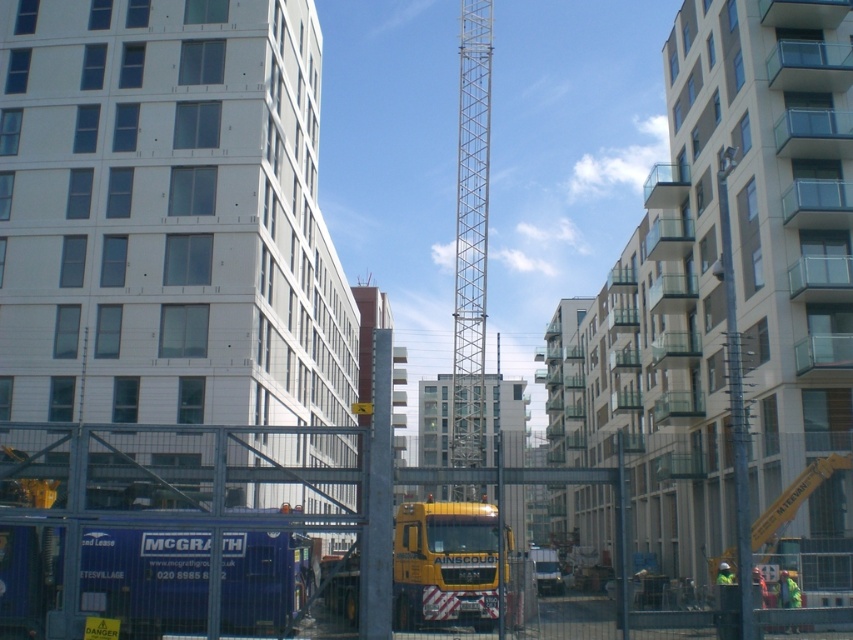
Question: Among these points, which one is nearest to the camera?

Choices:
 (A) (466, 99)
 (B) (491, 608)

Answer: (B)

Question: Can you confirm if metallic silver crane at center is positioned to the left of yellow metallic truck at center?

Choices:
 (A) no
 (B) yes

Answer: (A)

Question: Observing the image, what is the correct spatial positioning of metallic silver crane at center in reference to yellow metallic truck at center?

Choices:
 (A) right
 (B) left

Answer: (A)

Question: Among these objects, which one is nearest to the camera?

Choices:
 (A) yellow metallic truck at center
 (B) metallic silver crane at center

Answer: (B)

Question: Can you confirm if metallic silver crane at center is positioned to the right of yellow metallic truck at center?

Choices:
 (A) no
 (B) yes

Answer: (B)